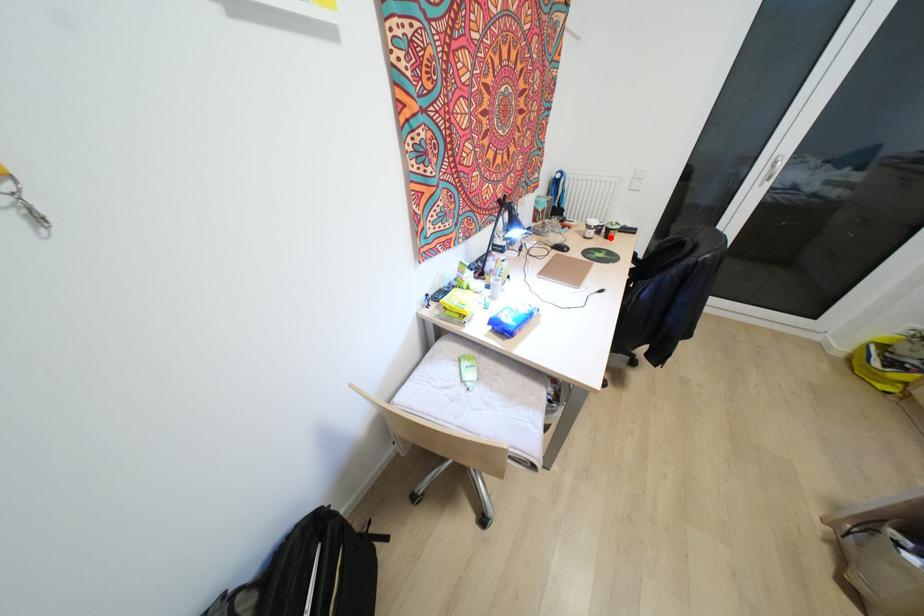
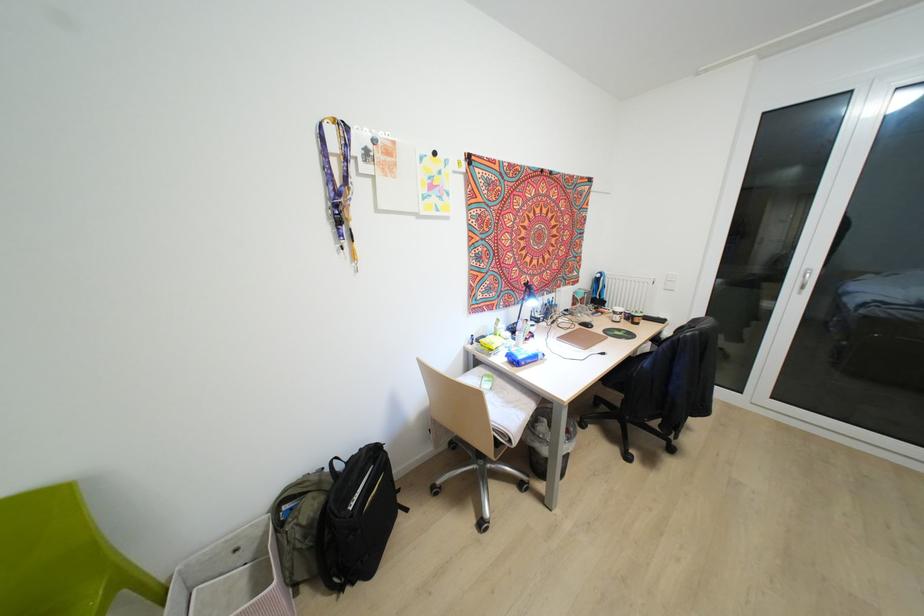
Where in the second image is the point corresponding to the highlighted location from the first image?

(637, 323)